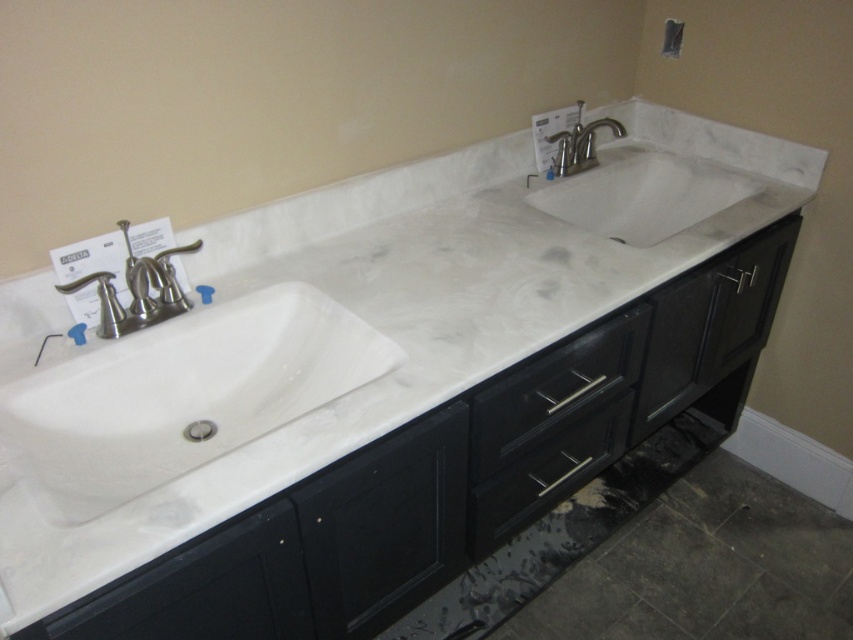
Which is in front, point (630, 216) or point (154, 307)?

Positioned in front is point (154, 307).

Can you confirm if white marble sink at center is taller than brushed nickel faucet at left?

Indeed, white marble sink at center has a greater height compared to brushed nickel faucet at left.

Where is `white marble sink at center`? white marble sink at center is located at coordinates (641, 192).

In the scene shown: Is white marble sink at center taller than polished chrome faucet at upper center?

Yes, white marble sink at center is taller than polished chrome faucet at upper center.

The width and height of the screenshot is (853, 640). What do you see at coordinates (641, 192) in the screenshot?
I see `white marble sink at center` at bounding box center [641, 192].

The height and width of the screenshot is (640, 853). I want to click on white marble sink at center, so click(641, 192).

Can you confirm if white marble sink at left is taller than white marble sink at center?

Indeed, white marble sink at left has a greater height compared to white marble sink at center.

Who is more forward, (90, 500) or (676, 216)?

Point (90, 500)

What are the coordinates of `white marble sink at left` in the screenshot? It's located at (177, 384).